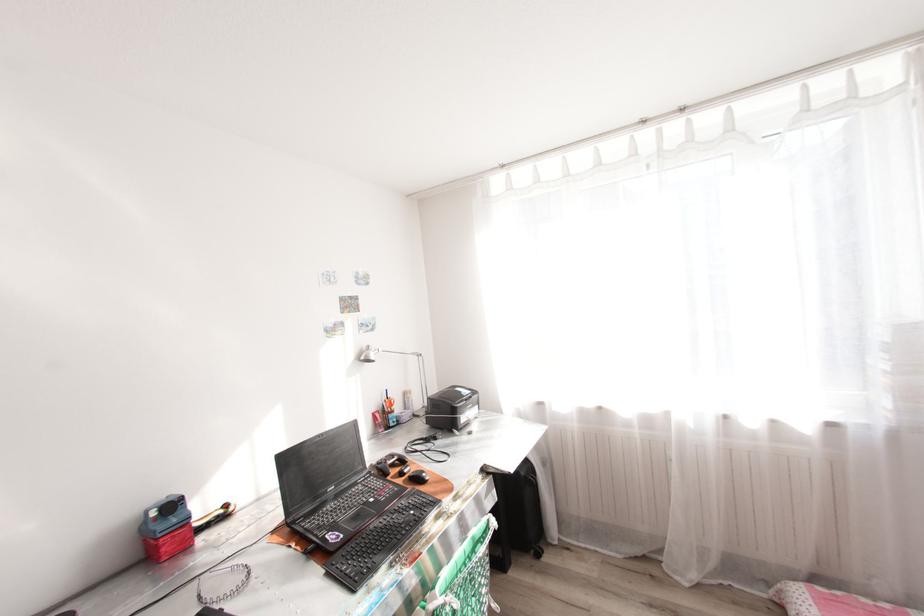
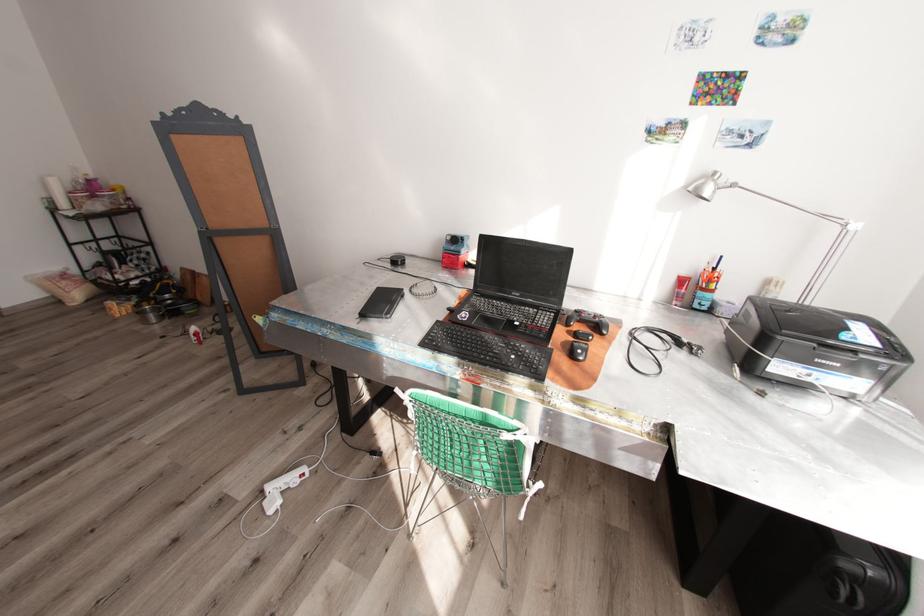
The point at (x=402, y=508) is marked in the first image. Where is the corresponding point in the second image?

(517, 344)